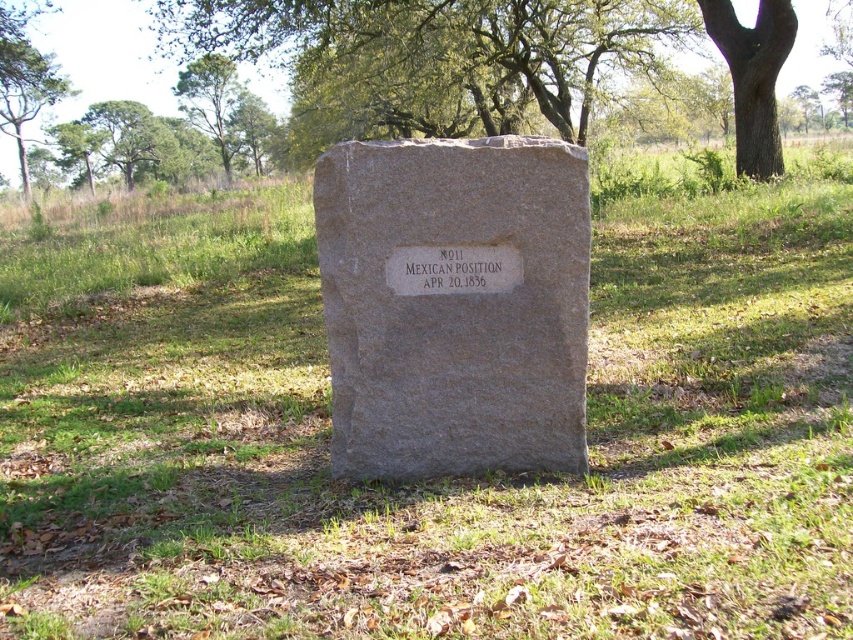
Which of these two, gray stone gravestone at center or green leafy tree at upper left, stands shorter?

Standing shorter between the two is green leafy tree at upper left.

Does gray stone gravestone at center have a smaller size compared to green leafy tree at upper left?

Incorrect, gray stone gravestone at center is not smaller in size than green leafy tree at upper left.

This screenshot has width=853, height=640. Describe the element at coordinates (454, 307) in the screenshot. I see `gray stone gravestone at center` at that location.

Find the location of a particular element. This screenshot has height=640, width=853. gray stone gravestone at center is located at coordinates (454, 307).

Between gray stone gravestone at center and smooth brown bark at upper right, which one appears on the right side from the viewer's perspective?

Positioned to the right is smooth brown bark at upper right.

Is gray stone gravestone at center to the right of smooth brown bark at upper right from the viewer's perspective?

No, gray stone gravestone at center is not to the right of smooth brown bark at upper right.

Identify the location of gray stone gravestone at center. (454, 307).

Does smooth brown bark at upper right come in front of etched stone plaque at center?

That is False.

Image resolution: width=853 pixels, height=640 pixels. Find the location of `smooth brown bark at upper right`. smooth brown bark at upper right is located at coordinates (753, 76).

You are a GUI agent. You are given a task and a screenshot of the screen. Output one action in this format:
    pyautogui.click(x=<x>, y=<y>)
    Task: Click on the smooth brown bark at upper right
    This screenshot has height=640, width=853.
    Given the screenshot: What is the action you would take?
    pyautogui.click(x=753, y=76)